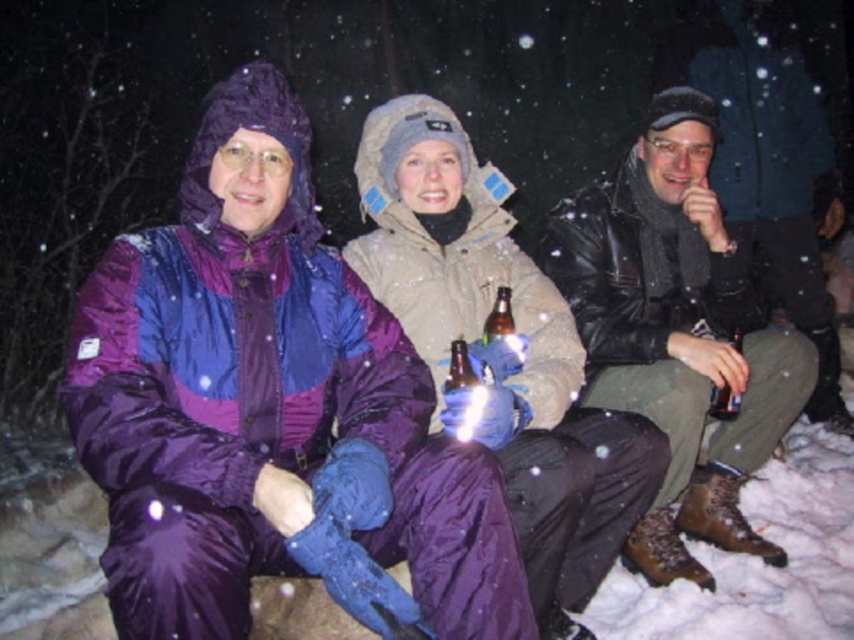
You are standing at the origin point in the image. There are two points marked in the scene. Which point is closer to you, point (636, 348) or point (512, 332)?

Point (512, 332) is closer to you because it is in front of point (636, 348).

You are standing in front of the group and want to hand a scarf to the person wearing the purple nylon jacket at center. Which direction should you move to reach them relative to the leather jacket at right?

The purple nylon jacket at center is to the left of the leather jacket at right, so you should move to the left side of the leather jacket at right to reach them.